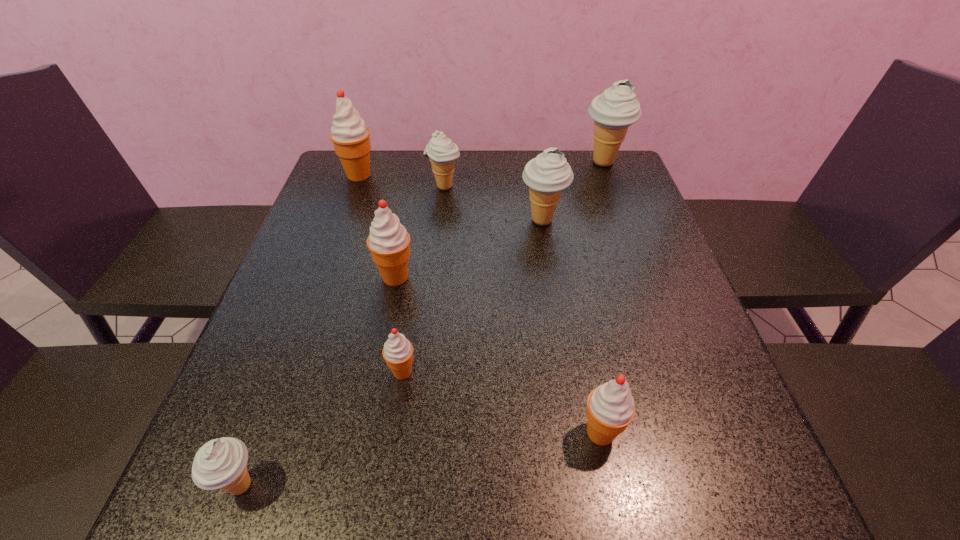
At what (x,y) coordinates should I click in order to perform the action: click on vacant region located on the right of the second smallest beige icecream. Please return your answer as a coordinate pair (x, y). Looking at the image, I should click on (496, 187).

Locate an element on the screen. This screenshot has width=960, height=540. free space located on the back of the nearest red icecream is located at coordinates (586, 359).

The width and height of the screenshot is (960, 540). What are the coordinates of `vacant point located on the right of the smallest red icecream` in the screenshot? It's located at (497, 372).

The height and width of the screenshot is (540, 960). In order to click on vacant space located 0.390m on the right of the nearest beige icecream in this screenshot , I will do `click(519, 485)`.

Where is `object positioned at the near edge`? The image size is (960, 540). object positioned at the near edge is located at coordinates (221, 463).

Where is `object positioned at the right edge`? The width and height of the screenshot is (960, 540). object positioned at the right edge is located at coordinates (613, 111).

The width and height of the screenshot is (960, 540). Identify the location of object that is at the far left corner. (350, 136).

Locate an element on the screen. The height and width of the screenshot is (540, 960). object that is positioned at the near left corner is located at coordinates (221, 463).

I want to click on object that is at the far right corner, so pos(613,111).

In the image, there is a desktop. Where is `free space at the far edge`? The height and width of the screenshot is (540, 960). free space at the far edge is located at coordinates (408, 189).